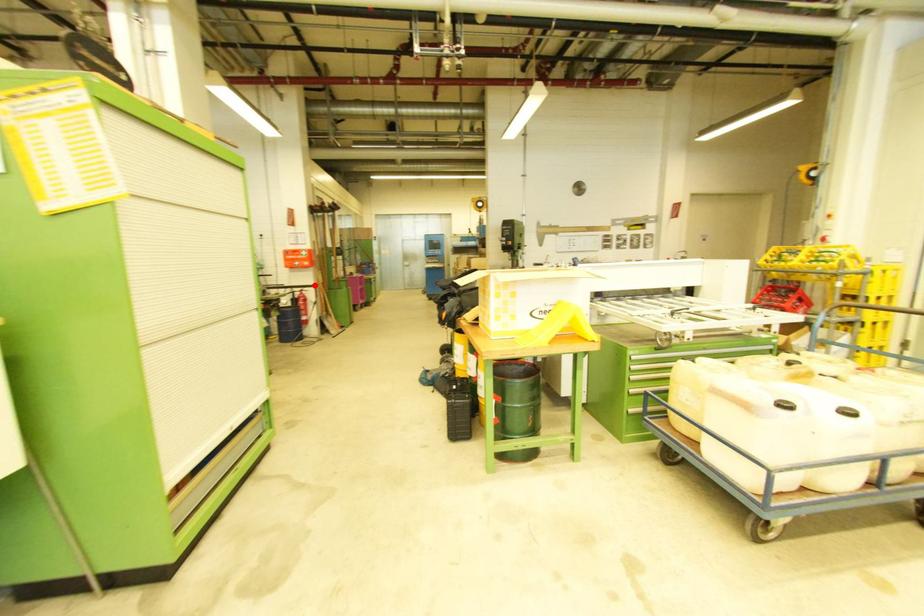
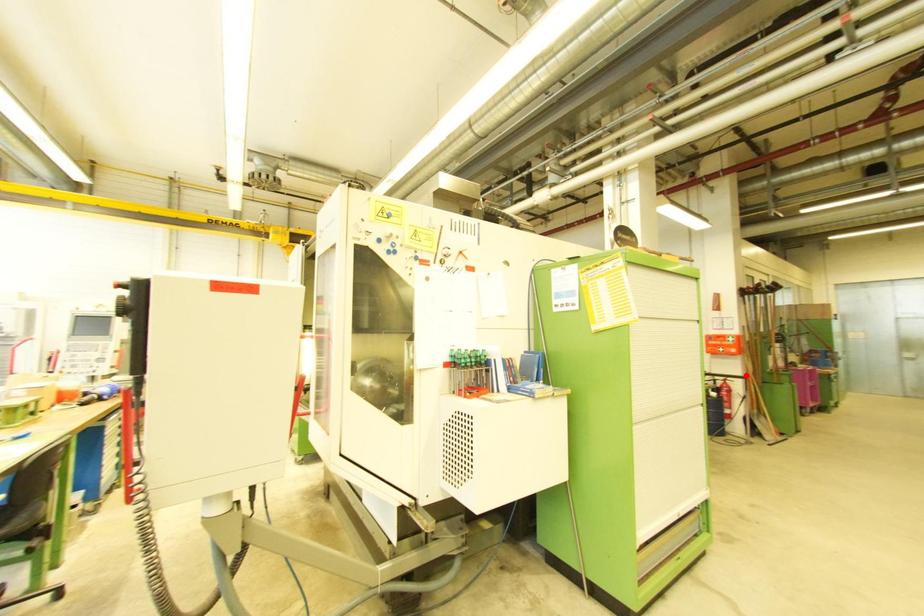
I am providing you with two images of the same scene from different viewpoints. A red point is marked on the first image and another point is marked on the second image. Do the highlighted points in image1 and image2 indicate the same real-world spot?

No